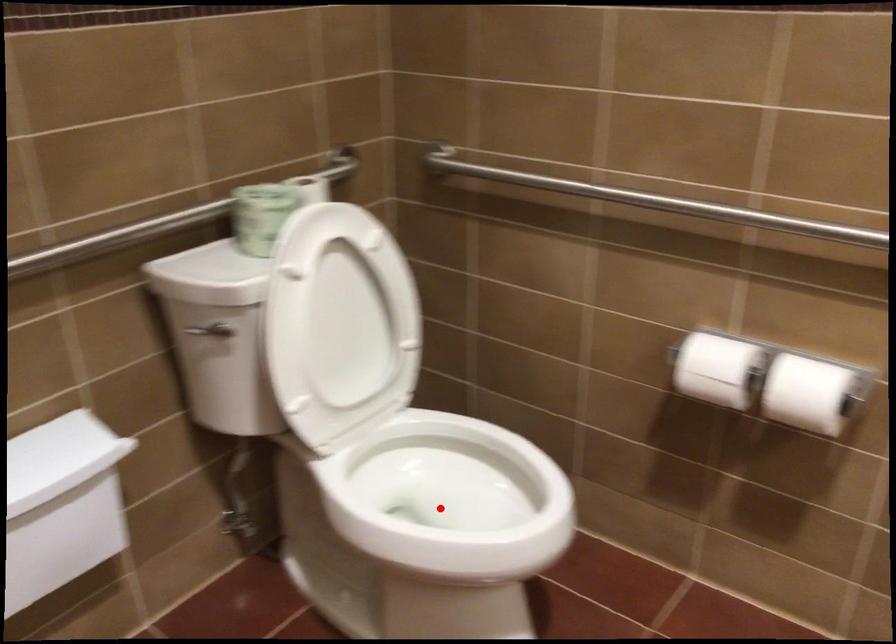
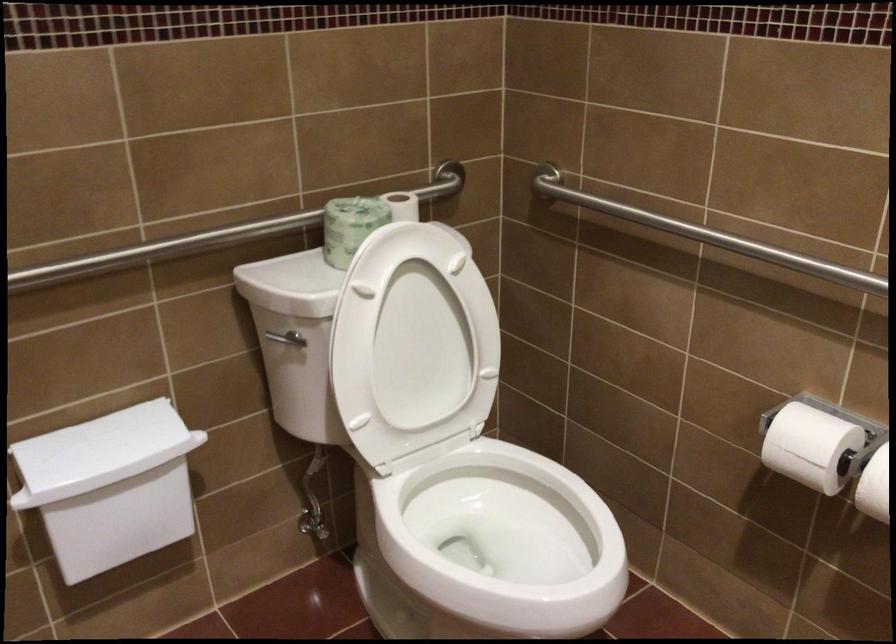
Find the pixel in the second image that matches the highlighted location in the first image.

(497, 544)